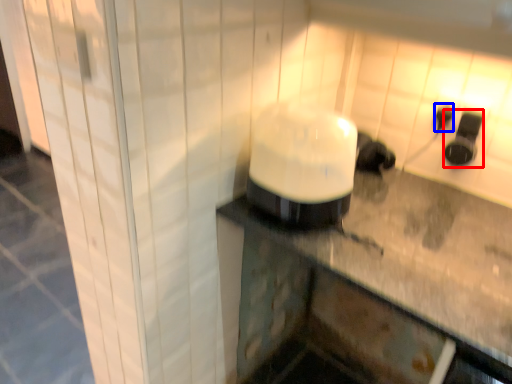
Question: Which object appears farthest to the camera in this image, appliance (highlighted by a red box) or electric outlet (highlighted by a blue box)?

Choices:
 (A) appliance
 (B) electric outlet

Answer: (B)